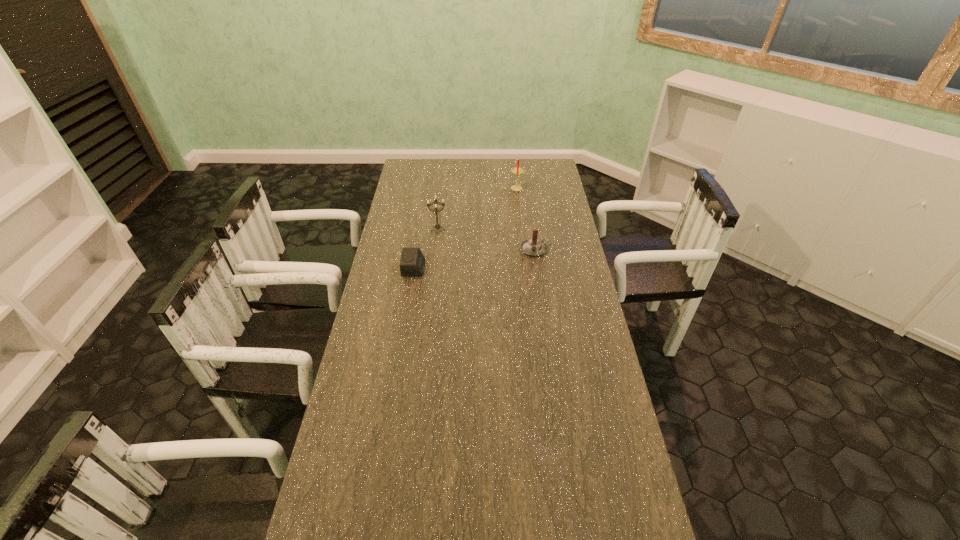
Identify the location of the taller candle. (517, 170).

Locate an element on the screen. This screenshot has width=960, height=540. the farthest object is located at coordinates (517, 170).

This screenshot has height=540, width=960. Identify the location of the second farthest object. (437, 226).

Image resolution: width=960 pixels, height=540 pixels. Identify the location of the second nearest object. (533, 247).

Find the location of a particular element. This screenshot has height=540, width=960. the shorter candle is located at coordinates (533, 247).

Where is `alarm clock`? alarm clock is located at coordinates (412, 263).

You are a GUI agent. You are given a task and a screenshot of the screen. Output one action in this format:
    pyautogui.click(x=<x>, y=<y>)
    Task: Click on the nearest object
    This screenshot has height=540, width=960.
    Given the screenshot: What is the action you would take?
    pyautogui.click(x=412, y=263)

The image size is (960, 540). Find the location of `vacant space located 0.090m on the right of the taller candle`. vacant space located 0.090m on the right of the taller candle is located at coordinates (545, 188).

Locate an element on the screen. This screenshot has width=960, height=540. vacant region located on the front of the candle holder is located at coordinates (432, 285).

I want to click on free space located 0.060m on the side of the second nearest object with the handle loop, so click(x=565, y=249).